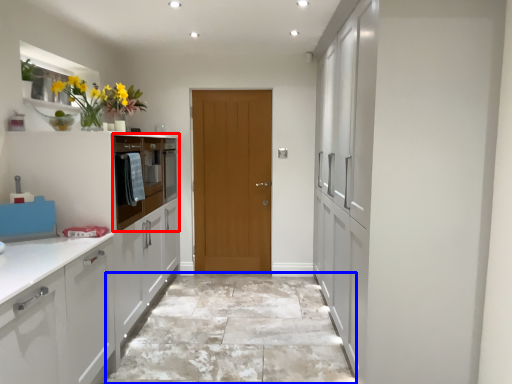
Question: Which of the following is the closest to the observer, oven (highlighted by a red box) or granite (highlighted by a blue box)?

Choices:
 (A) oven
 (B) granite

Answer: (B)